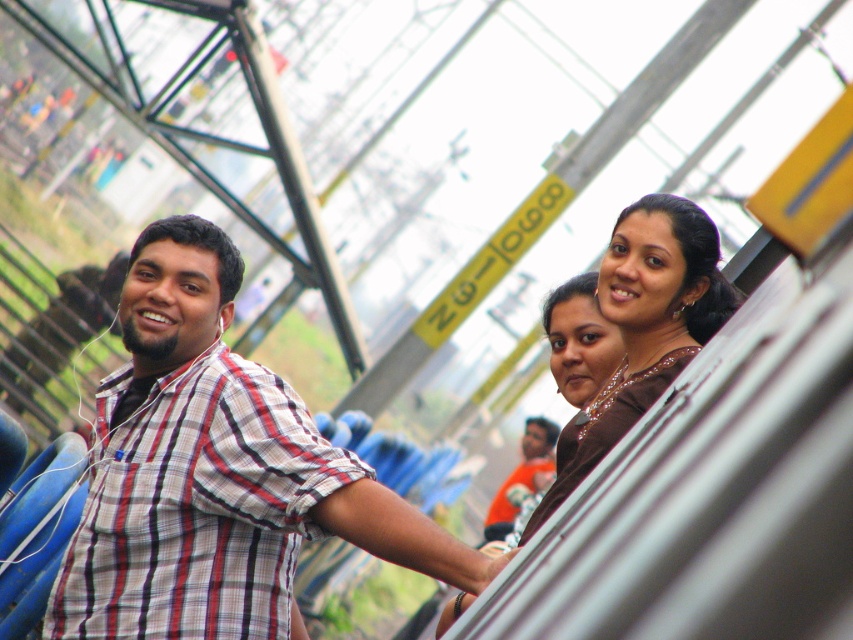
Question: Considering the real-world distances, which object is farthest from the plaid shirt at left?

Choices:
 (A) brown satin dress at upper right
 (B) orange shirt at center

Answer: (B)

Question: Is plaid shirt at left smaller than brown satin dress at upper right?

Choices:
 (A) yes
 (B) no

Answer: (B)

Question: Based on their relative distances, which object is farther from the plaid shirt at left?

Choices:
 (A) orange shirt at center
 (B) plaid cotton shirt at left
 (C) brown satin dress at upper right

Answer: (A)

Question: Which object is positioned farthest from the orange shirt at center?

Choices:
 (A) brown satin dress at upper right
 (B) plaid shirt at left

Answer: (B)

Question: Can you confirm if plaid shirt at left is smaller than brown satin dress at upper right?

Choices:
 (A) no
 (B) yes

Answer: (A)

Question: In this image, where is plaid cotton shirt at left located relative to orange shirt at center?

Choices:
 (A) left
 (B) right

Answer: (A)